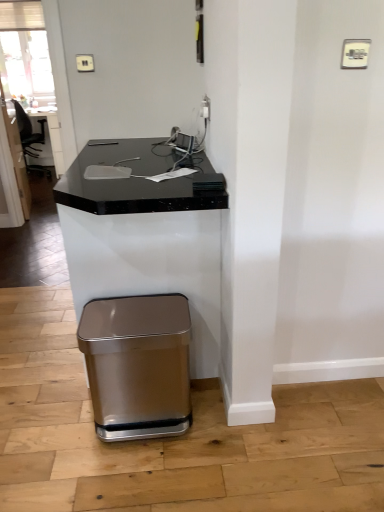
Question: In the image, is black marble computer desk at center on the left side or the right side of satin metallic trash can at lower left?

Choices:
 (A) right
 (B) left

Answer: (B)

Question: Considering the positions of black marble computer desk at center and satin metallic trash can at lower left in the image, is black marble computer desk at center bigger or smaller than satin metallic trash can at lower left?

Choices:
 (A) small
 (B) big

Answer: (B)

Question: Considering the positions of black marble computer desk at center and satin metallic trash can at lower left in the image, is black marble computer desk at center wider or thinner than satin metallic trash can at lower left?

Choices:
 (A) wide
 (B) thin

Answer: (A)

Question: From the image's perspective, is satin metallic trash can at lower left above or below black marble computer desk at center?

Choices:
 (A) below
 (B) above

Answer: (A)

Question: From a real-world perspective, is satin metallic trash can at lower left positioned above or below black marble computer desk at center?

Choices:
 (A) above
 (B) below

Answer: (B)

Question: Is satin metallic trash can at lower left in front of or behind black marble computer desk at center in the image?

Choices:
 (A) behind
 (B) front

Answer: (A)

Question: Is satin metallic trash can at lower left bigger or smaller than black marble computer desk at center?

Choices:
 (A) small
 (B) big

Answer: (A)